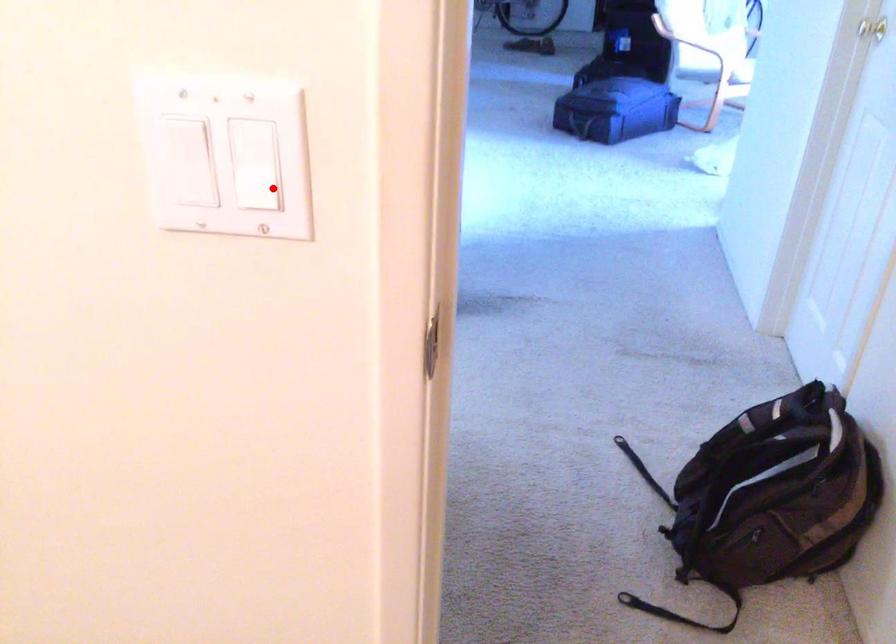
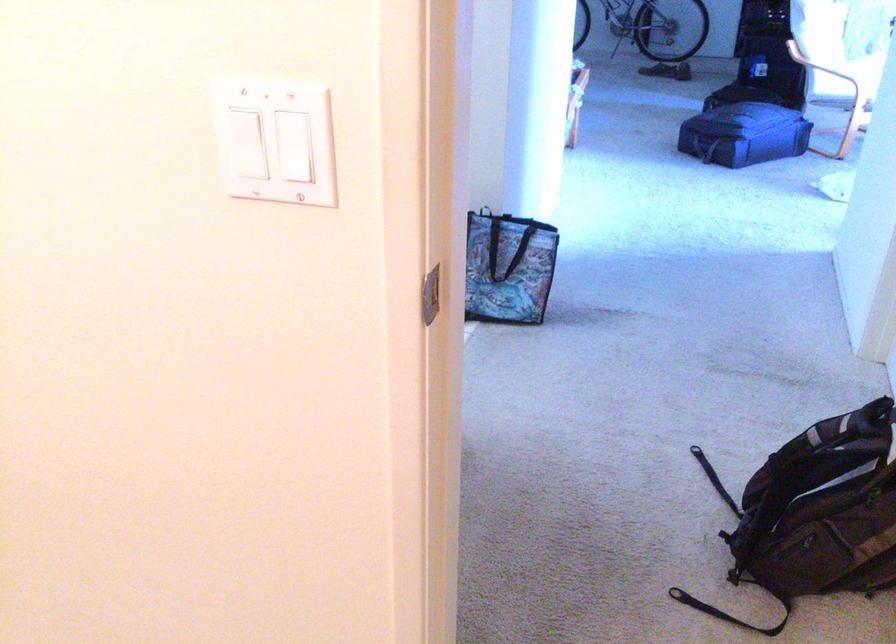
Question: I am providing you with two images of the same scene from different viewpoints. Image1 has a red point marked. In image2, the corresponding 3D location appears at what relative position? Reply with the corresponding letter.

Choices:
 (A) Closer
 (B) Farther

Answer: (B)